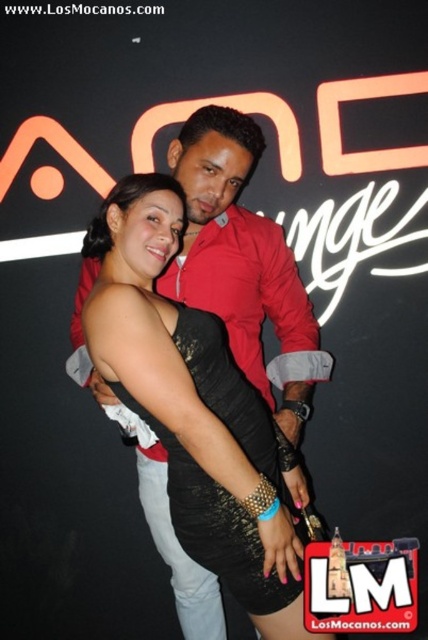
Does black sequined dress at center have a greater height compared to black lace dress at center?

Yes, black sequined dress at center is taller than black lace dress at center.

Who is higher up, black sequined dress at center or black lace dress at center?

black sequined dress at center is higher up.

Does point (211, 273) come in front of point (186, 316)?

No, (211, 273) is further to viewer.

In order to click on black sequined dress at center in this screenshot , I will do `click(243, 262)`.